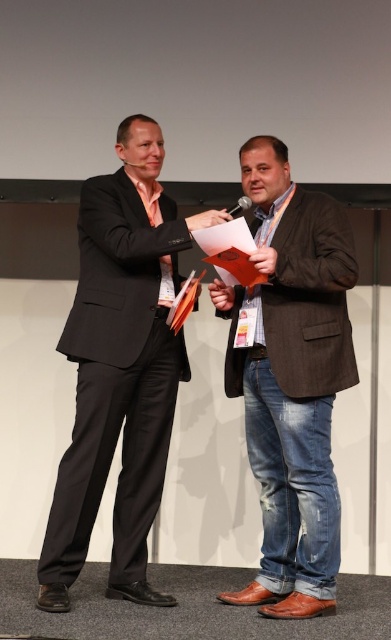
Which is in front, point (91, 220) or point (304, 232)?

Point (304, 232) is more forward.

Is matte black suit at left thinner than brown leather shoes at center?

In fact, matte black suit at left might be wider than brown leather shoes at center.

Is point (145, 326) farther from viewer compared to point (324, 324)?

That is True.

Find the location of a particular element. matte black suit at left is located at coordinates (120, 369).